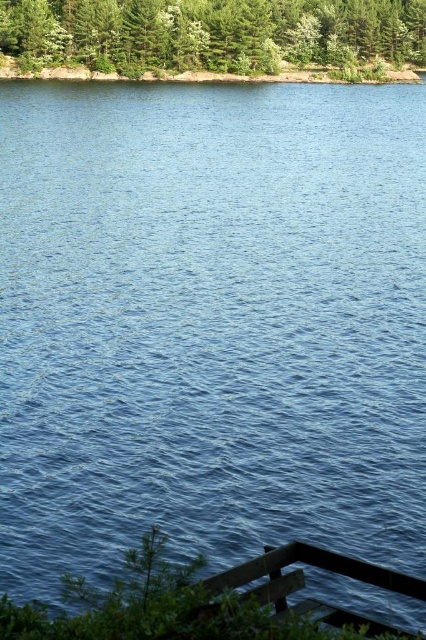
From the picture: You are standing on the wooden dock at lower right and want to take a photo of the green leafy trees at upper center. Considering their sizes, which object would appear bigger in the photo?

The green leafy trees at upper center would appear bigger in the photo because they are larger in size compared to the wooden dock at lower right.

You are standing on the wooden dock at lower right and want to reach the green leafy trees at upper center. Given that you can walk at a speed of 3 feet per second, how long will it take you to reach the trees?

The distance between the green leafy trees at upper center and the wooden dock at lower right is 389.23 feet. At a walking speed of 3 feet per second, it would take approximately 129.74 seconds to reach the trees.